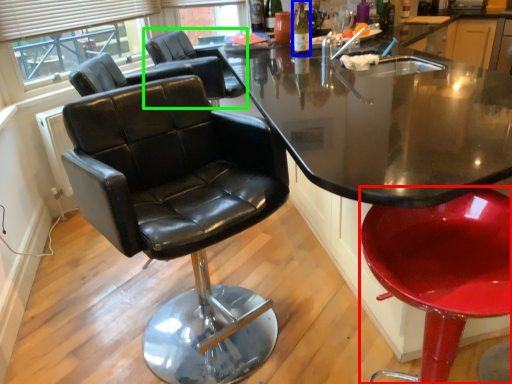
Question: Which object is the farthest from chair (highlighted by a red box)? Choose among these: bottle (highlighted by a blue box) or chair (highlighted by a green box).

Choices:
 (A) bottle
 (B) chair

Answer: (B)